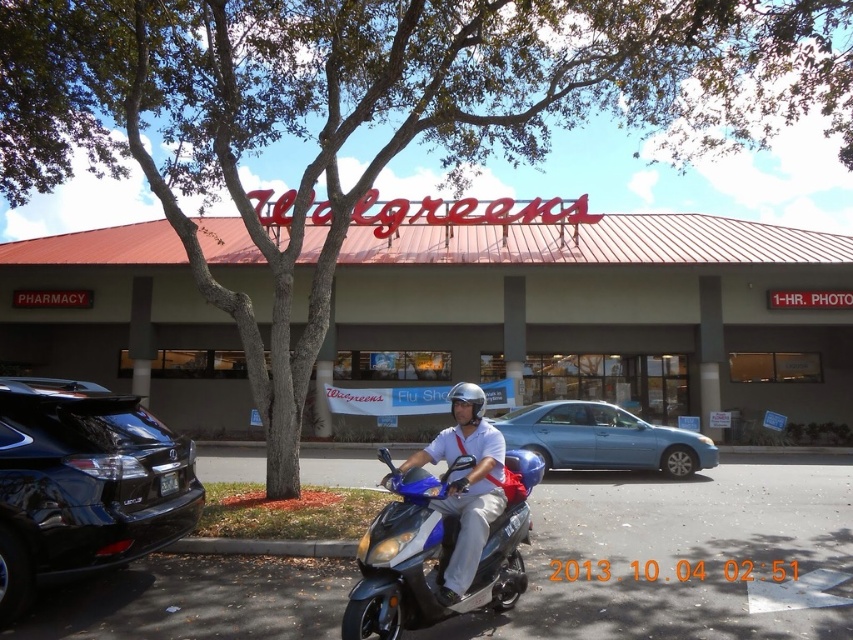
Which is below, matte gray building at center or metallic blue scooter at center?

metallic blue scooter at center is below.

Does matte gray building at center have a greater width compared to metallic blue scooter at center?

Indeed, matte gray building at center has a greater width compared to metallic blue scooter at center.

Which is behind, point (68, 307) or point (366, 545)?

The point (68, 307) is more distant.

The image size is (853, 640). I want to click on matte gray building at center, so click(x=601, y=314).

Between point (206, 412) and point (459, 397), which one is positioned in front?

Point (459, 397)

Measure the distance between point (567, 301) and camera.

Answer: 58.85 feet

You are a GUI agent. You are given a task and a screenshot of the screen. Output one action in this format:
    pyautogui.click(x=<x>, y=<y>)
    Task: Click on the matte gray building at center
    
    Given the screenshot: What is the action you would take?
    pyautogui.click(x=601, y=314)

Who is shorter, matte blue scooter at center or blue matte helmet at center?

Standing shorter between the two is blue matte helmet at center.

Between point (479, 444) and point (511, 476), which one is positioned behind?

The point (511, 476) is more distant.

Who is more forward, [460,440] or [540,468]?

Point [460,440] is more forward.

Locate an element on the screen. Image resolution: width=853 pixels, height=640 pixels. matte blue scooter at center is located at coordinates [x=467, y=483].